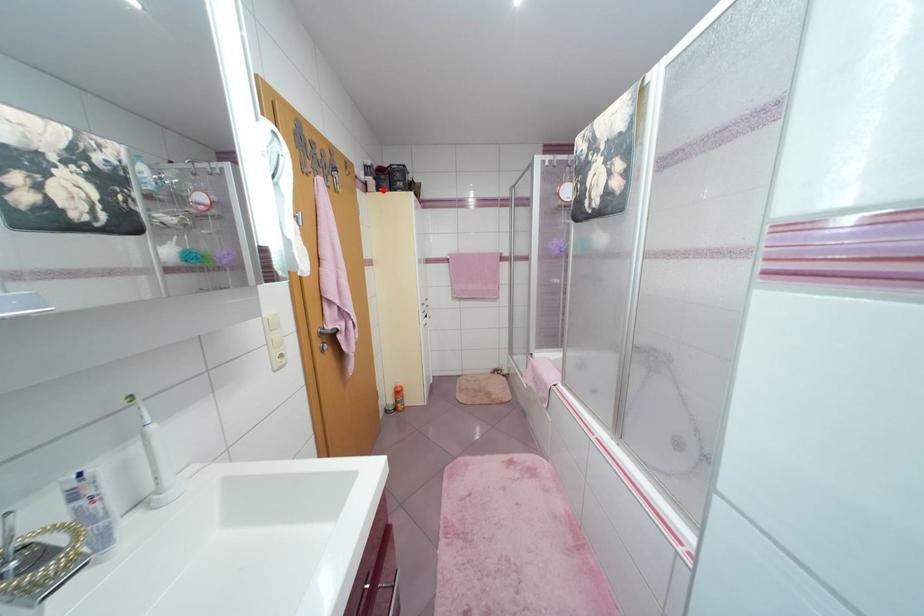
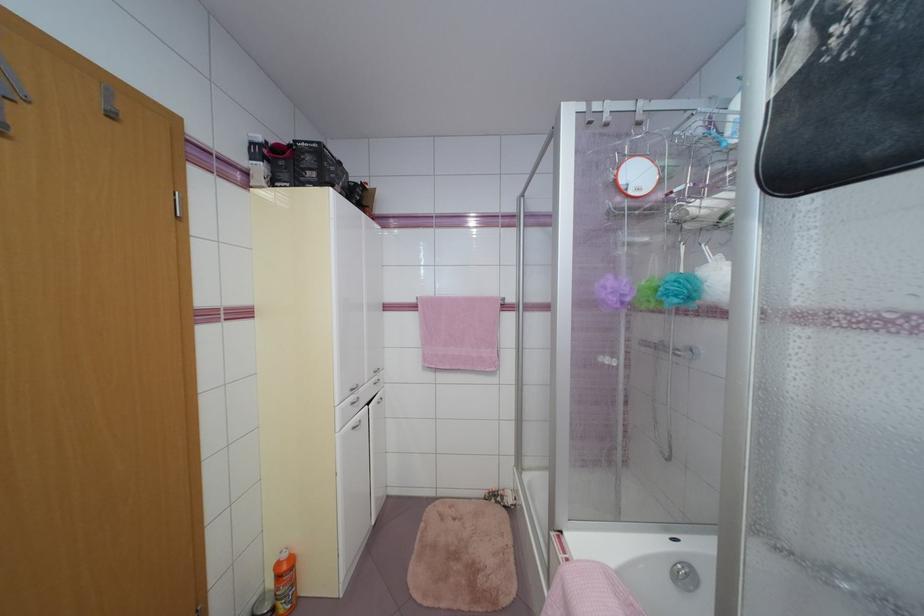
Question: I am providing you with two images of the same scene from different viewpoints. A red point is shown in image1. For the corresponding object point in image2, is it positioned nearer or farther from the camera?

Choices:
 (A) Nearer
 (B) Farther

Answer: (B)